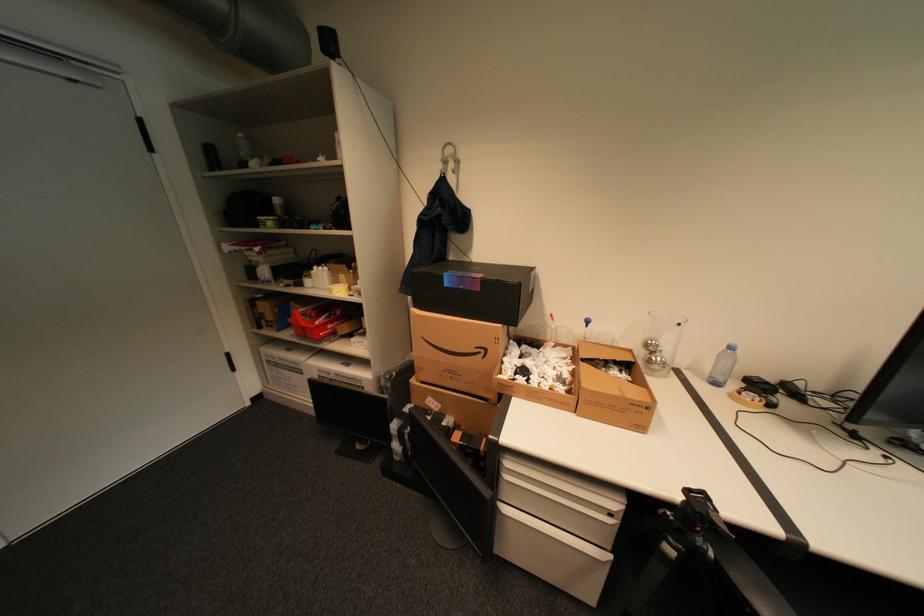
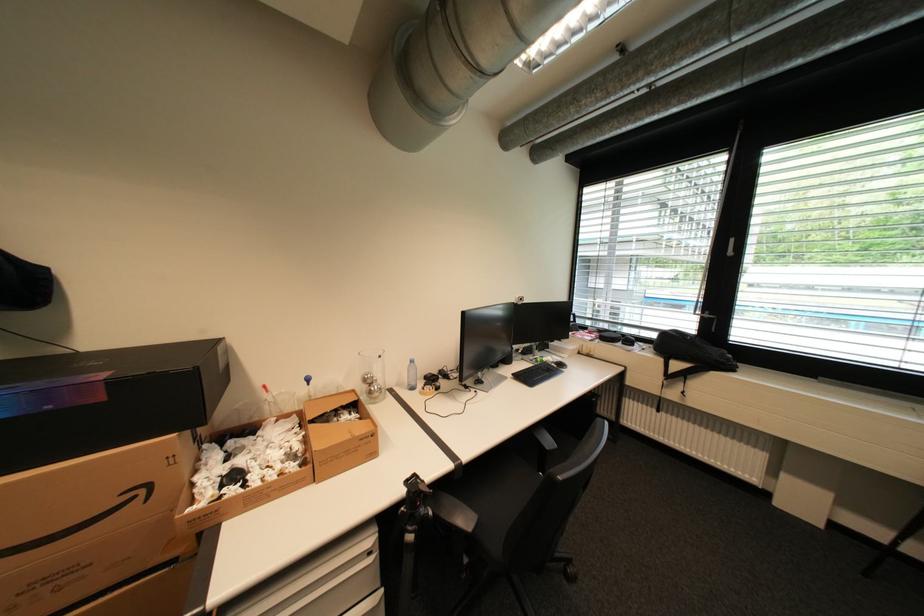
In the second image, find the point that corresponds to point 696,493 in the first image.

(416, 484)